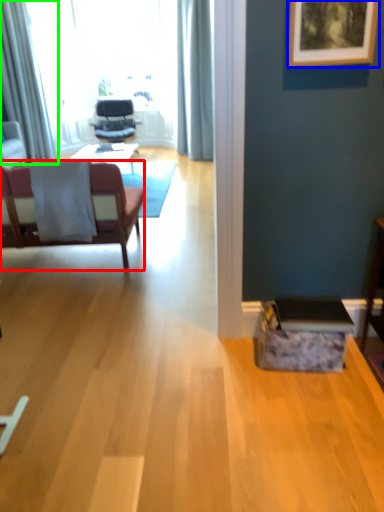
Question: Which is farther away from chair (highlighted by a red box)? picture frame (highlighted by a blue box) or curtain (highlighted by a green box)?

Choices:
 (A) picture frame
 (B) curtain

Answer: (A)